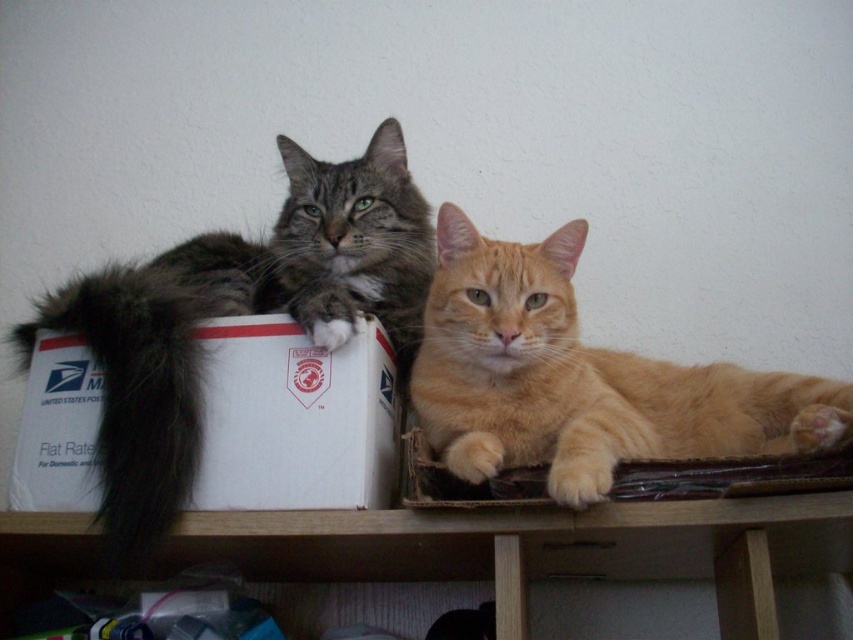
You are a delivery person who needs to place a package on the desk. The package requires 20 inches of space. Looking at the image, is there enough space between the orange fur cat at center and the dark brown fur tail at left to place the package?

The distance between the orange fur cat at center and the dark brown fur tail at left is 18.98 inches, which is less than the required 20 inches. Therefore, there is not enough space to place the package between them.

You are a delivery person who needs to place a new package on the desk. The new package is 4 inches wide. Can you place it between the white cardboard box at left and the dark brown fur tail at left without disturbing them?

The distance between the white cardboard box at left and the dark brown fur tail at left is 3.70 inches. Since the new package is 4 inches wide, which is slightly wider than the available space, it won

You are a delivery person who needs to place a package on the desk. There is an orange fur cat at center and a dark brown fur tail at left. Can you place the package between them without touching either?

The orange fur cat at center is located above the dark brown fur tail at left, so there is vertical space between them. However, since the tail is part of the cat on the left, placing a package between them might still disturb the cat. Consider moving the package to another area.